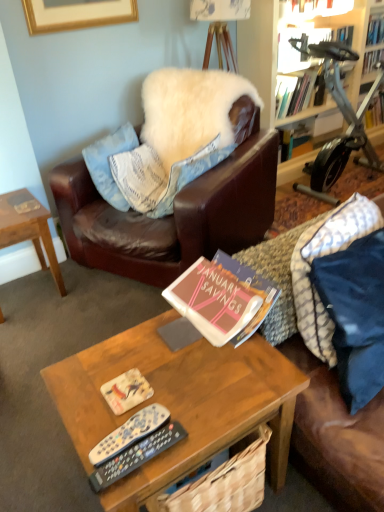
The image size is (384, 512). Find the location of `free point behind black plastic remote control at lower center, acting as the 2th remote control starting from the front`. free point behind black plastic remote control at lower center, acting as the 2th remote control starting from the front is located at coordinates (140, 378).